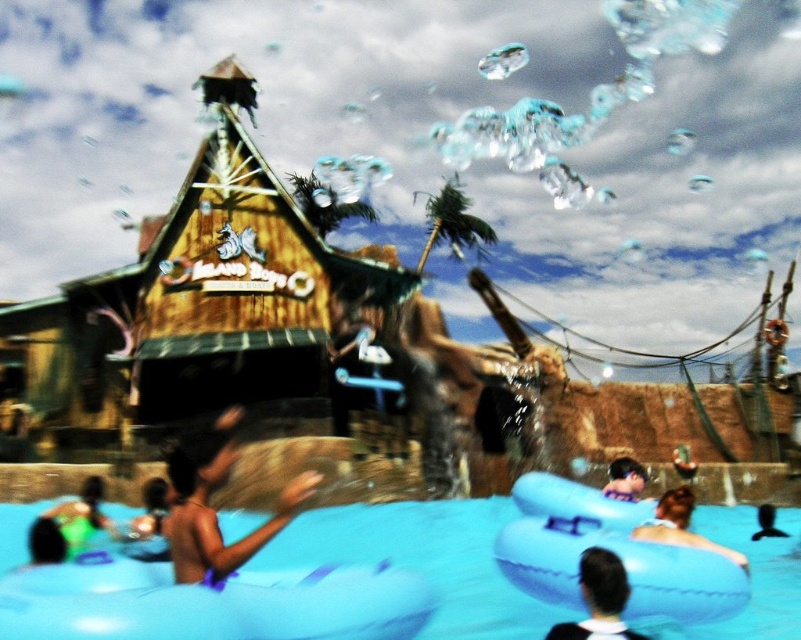
Question: Is blue rubber float at center thinner than black matte hair at center?

Choices:
 (A) no
 (B) yes

Answer: (A)

Question: Estimate the real-world distances between objects in this image. Which object is farther from the green inflatable ring at lower left?

Choices:
 (A) smooth skin person at lower right
 (B) blue rubber float at center

Answer: (A)

Question: Among these points, which one is nearest to the camera?

Choices:
 (A) (638, 477)
 (B) (139, 525)

Answer: (B)

Question: Does black matte hair at center have a greater width compared to smooth skin person at lower left?

Choices:
 (A) yes
 (B) no

Answer: (A)

Question: Based on their relative distances, which object is farther from the smooth skin person at lower right?

Choices:
 (A) blonde hair at lower right
 (B) green inflatable ring at lower left

Answer: (B)

Question: Does brown skin at center appear under smooth skin person at lower left?

Choices:
 (A) no
 (B) yes

Answer: (A)